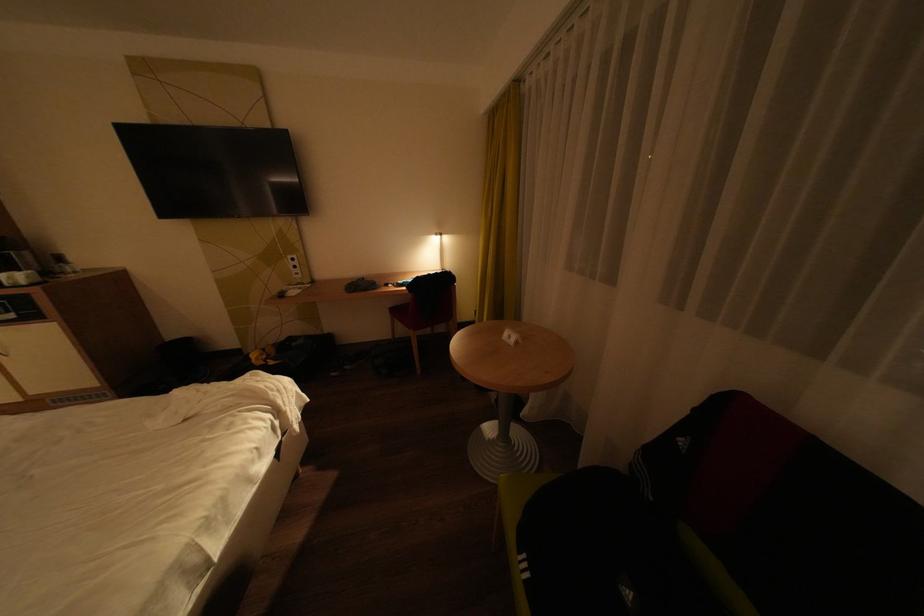
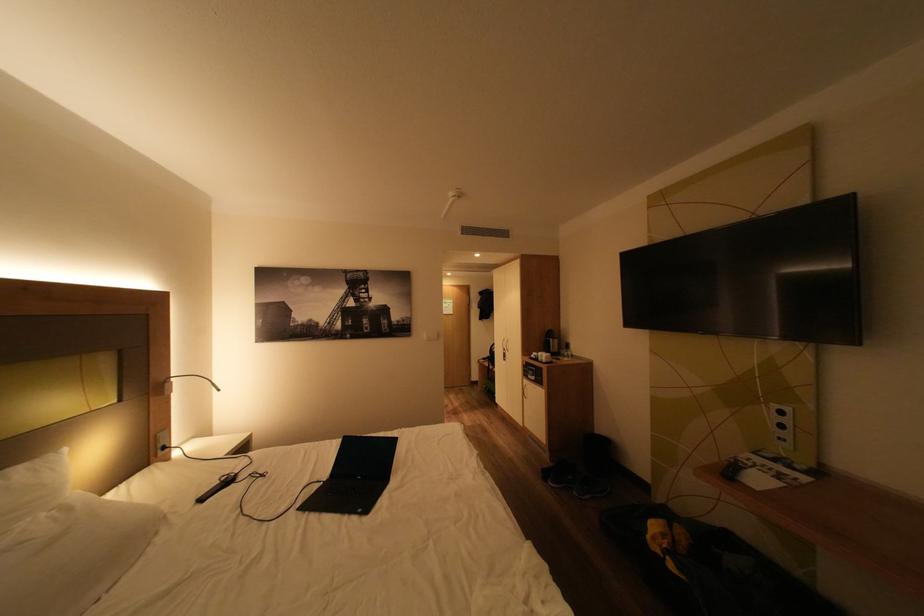
In the second image, find the point that corresponds to (x=306, y=267) in the first image.

(793, 427)